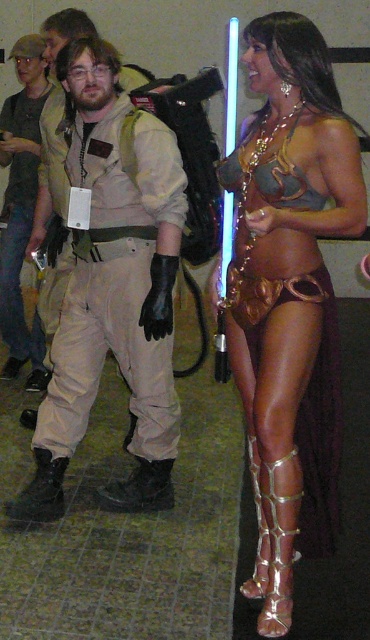
Question: In this image, where is metallic gold bikini at center located relative to matte khaki pants at left?

Choices:
 (A) left
 (B) right

Answer: (B)

Question: Considering the real-world distances, which object is closest to the metallic gold bikini at center?

Choices:
 (A) matte khaki pants at left
 (B) khaki cotton pants at center

Answer: (B)

Question: Which object is positioned farthest from the khaki cotton pants at center?

Choices:
 (A) matte khaki pants at left
 (B) metallic gold bikini at center

Answer: (A)

Question: Is metallic gold bikini at center smaller than khaki cotton pants at center?

Choices:
 (A) no
 (B) yes

Answer: (B)

Question: Which of the following is the farthest from the observer?

Choices:
 (A) matte khaki pants at left
 (B) metallic gold bikini at center
 (C) khaki cotton pants at center

Answer: (A)

Question: Does khaki cotton pants at center lie behind matte khaki pants at left?

Choices:
 (A) no
 (B) yes

Answer: (A)